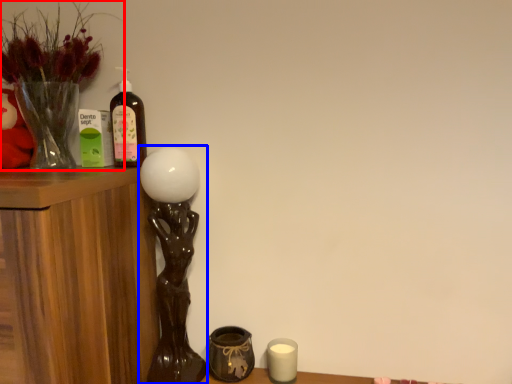
Question: Among these objects, which one is nearest to the camera, houseplant (highlighted by a red box) or table lamp (highlighted by a blue box)?

Choices:
 (A) houseplant
 (B) table lamp

Answer: (A)